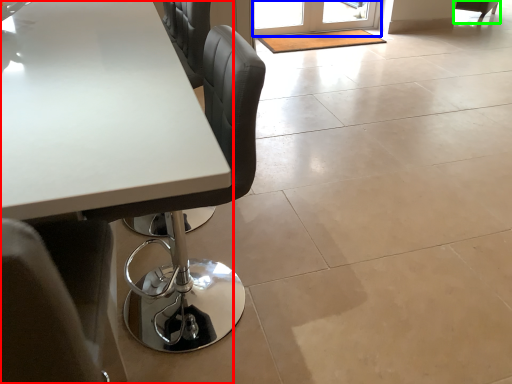
Question: Which is nearer to the table (highlighted by a red box)? screen door (highlighted by a blue box) or chair (highlighted by a green box).

Choices:
 (A) screen door
 (B) chair

Answer: (A)